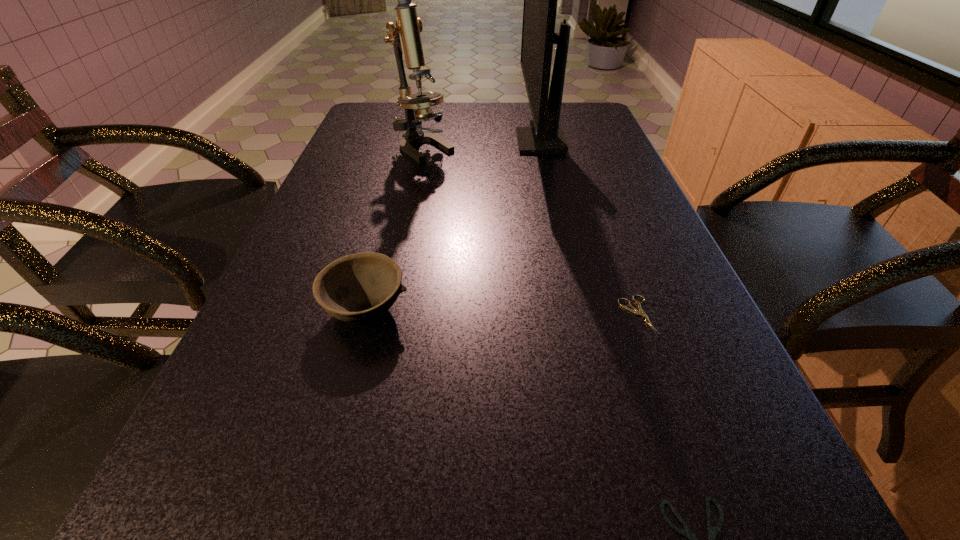
Identify the location of free space located 0.170m on the left of the taller shears. The width and height of the screenshot is (960, 540). (523, 315).

The image size is (960, 540). I want to click on object that is positioned at the far edge, so click(x=546, y=136).

This screenshot has width=960, height=540. In order to click on microscope that is at the left edge in this screenshot , I will do `click(405, 37)`.

Locate an element on the screen. This screenshot has height=540, width=960. bowl that is at the left edge is located at coordinates (356, 288).

Locate an element on the screen. This screenshot has height=540, width=960. computer monitor present at the right edge is located at coordinates (546, 136).

Where is `shears that is at the right edge`? shears that is at the right edge is located at coordinates (633, 310).

Where is `object situated at the far right corner`? The height and width of the screenshot is (540, 960). object situated at the far right corner is located at coordinates (546, 136).

In the image, there is a desktop. Identify the location of free region at the far edge. This screenshot has height=540, width=960. pos(464,118).

Where is `vacant region at the left edge of the desktop`? vacant region at the left edge of the desktop is located at coordinates (321, 188).

In the image, there is a desktop. Identify the location of vacant region at the right edge. (574, 180).